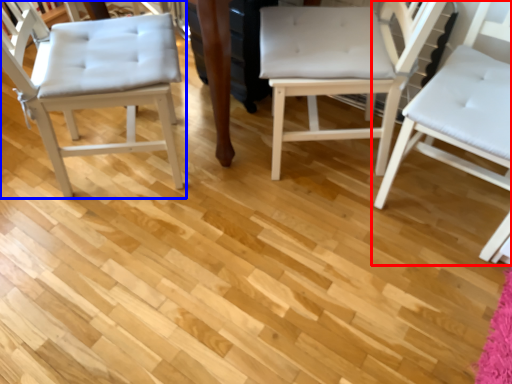
Question: Among these objects, which one is nearest to the camera, chair (highlighted by a red box) or chair (highlighted by a blue box)?

Choices:
 (A) chair
 (B) chair

Answer: (A)